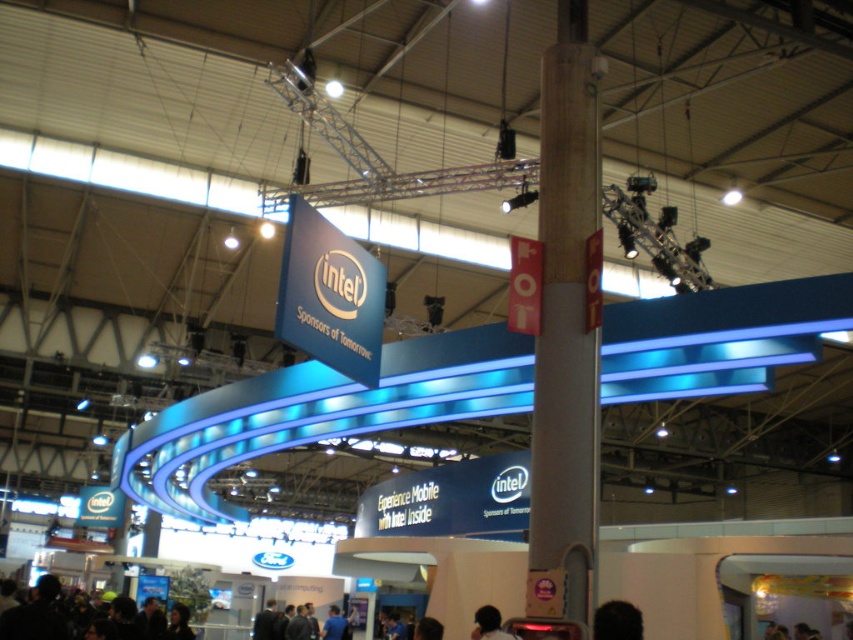
This screenshot has width=853, height=640. Describe the element at coordinates (566, 323) in the screenshot. I see `wooden pole at center` at that location.

Is point (596, 374) behind point (474, 618)?

No, it is in front of (474, 618).

Locate an element on the screen. wooden pole at center is located at coordinates (566, 323).

Does dark hair at lower center have a larger size compared to dark brown hair at lower center?

No.

Can you confirm if dark hair at lower center is positioned to the right of dark brown hair at lower center?

Indeed, dark hair at lower center is positioned on the right side of dark brown hair at lower center.

The width and height of the screenshot is (853, 640). I want to click on dark hair at lower center, so click(618, 620).

Locate an element on the screen. This screenshot has height=640, width=853. dark hair at lower center is located at coordinates (618, 620).

Which is above, wooden pole at center or dark hair at lower center?

Positioned higher is wooden pole at center.

Who is more distant from viewer, (549, 230) or (599, 612)?

The point (549, 230) is more distant.

At what (x,y) coordinates should I click in order to perform the action: click on wooden pole at center. Please return your answer as a coordinate pair (x, y). The image size is (853, 640). Looking at the image, I should click on (566, 323).